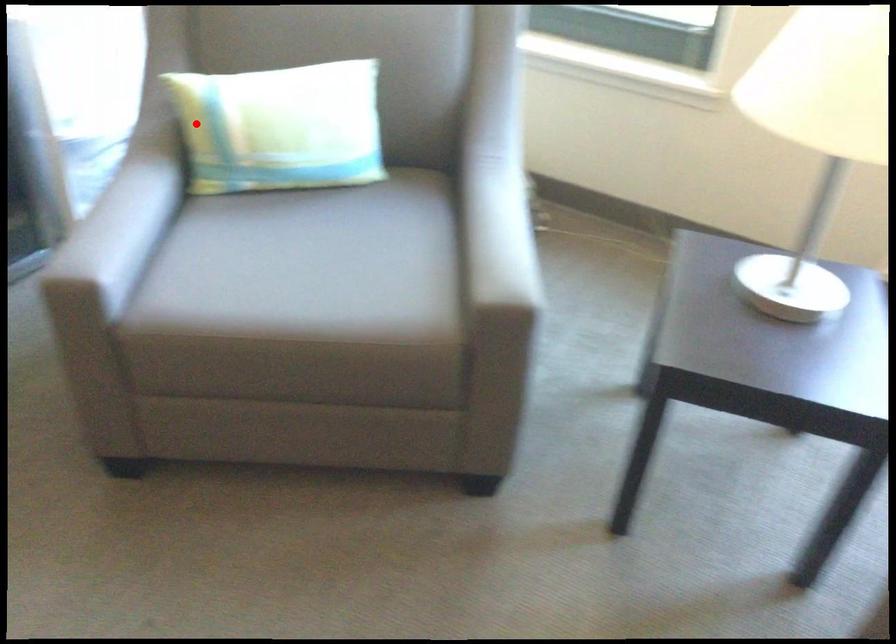
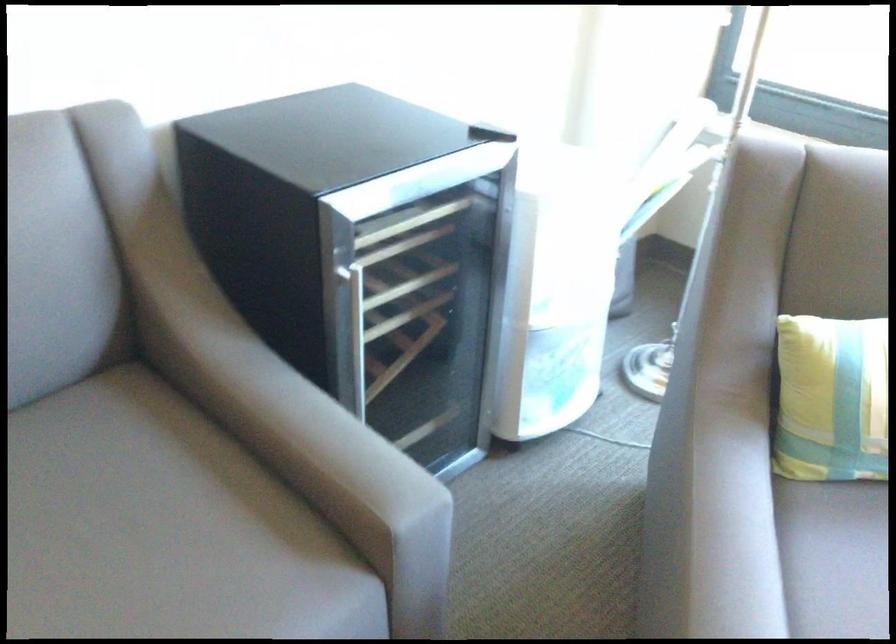
Question: I am providing you with two images of the same scene from different viewpoints. In image1, a red point is highlighted. Considering the same 3D point in image2, which of the following is correct?

Choices:
 (A) It is closer
 (B) It is farther

Answer: (A)